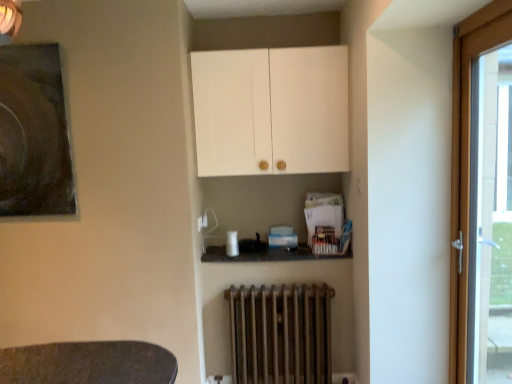
Question: Is white matte cabinet at upper center wider than wooden door at right?

Choices:
 (A) yes
 (B) no

Answer: (A)

Question: Is white matte cabinet at upper center outside wooden door at right?

Choices:
 (A) yes
 (B) no

Answer: (A)

Question: Considering the relative sizes of white matte cabinet at upper center and wooden door at right in the image provided, is white matte cabinet at upper center thinner than wooden door at right?

Choices:
 (A) yes
 (B) no

Answer: (B)

Question: Is white matte cabinet at upper center not close to wooden door at right?

Choices:
 (A) yes
 (B) no

Answer: (B)

Question: Considering the relative sizes of white matte cabinet at upper center and wooden door at right in the image provided, is white matte cabinet at upper center taller than wooden door at right?

Choices:
 (A) no
 (B) yes

Answer: (A)

Question: In terms of height, does white matte cabinet at upper center look taller or shorter compared to wooden door at right?

Choices:
 (A) tall
 (B) short

Answer: (B)

Question: Would you say white matte cabinet at upper center is inside or outside wooden door at right?

Choices:
 (A) outside
 (B) inside

Answer: (A)

Question: From a real-world perspective, relative to wooden door at right, is white matte cabinet at upper center vertically above or below?

Choices:
 (A) below
 (B) above

Answer: (B)

Question: Does point (256, 152) appear closer or farther from the camera than point (481, 23)?

Choices:
 (A) farther
 (B) closer

Answer: (A)

Question: From a real-world perspective, is white matte cabinet at upper center above or below dark matte painting at upper left?

Choices:
 (A) above
 (B) below

Answer: (A)

Question: In terms of size, does white matte cabinet at upper center appear bigger or smaller than dark matte painting at upper left?

Choices:
 (A) big
 (B) small

Answer: (A)

Question: Is point (202, 54) positioned closer to the camera than point (7, 64)?

Choices:
 (A) farther
 (B) closer

Answer: (A)

Question: In the image, is white matte cabinet at upper center positioned in front of or behind dark matte painting at upper left?

Choices:
 (A) behind
 (B) front

Answer: (A)

Question: Looking at their shapes, would you say dark matte painting at upper left is wider or thinner than rusty metal radiator at lower center?

Choices:
 (A) thin
 (B) wide

Answer: (A)

Question: Considering their positions, is dark matte painting at upper left located in front of or behind rusty metal radiator at lower center?

Choices:
 (A) behind
 (B) front

Answer: (B)